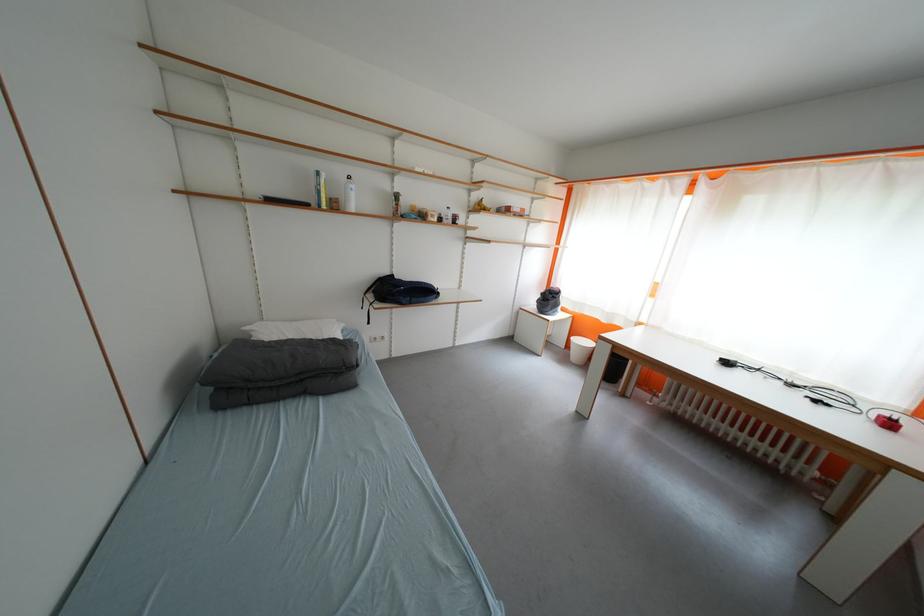
Locate an element on the screen. Image resolution: width=924 pixels, height=616 pixels. wardrobe door handle is located at coordinates (466, 222).